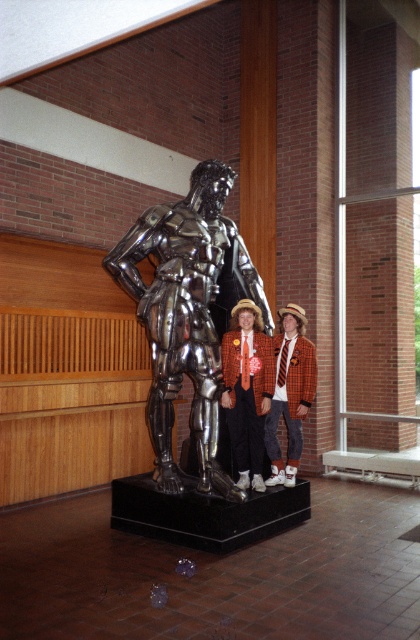
You are an interior designer evaluating the space in the image. You need to determine if the shiny metallic statue at center will fit through a doorway that is the same height as the orange wool blazer at center. Can it pass through?

The shiny metallic statue at center is bigger than the orange wool blazer at center, so it cannot pass through the doorway that is the same height as the orange wool blazer at center.

You are a photographer trying to capture a photo where both the shiny metallic statue at center and the orange wool blazer at center are in focus. Given that the statue is wider than the blazer, which object should you adjust your camera focus on first to ensure both are sharp?

Since the shiny metallic statue at center is wider than the orange wool blazer at center, you should focus on the statue first as it occupies more space in the frame, ensuring both objects remain in focus.